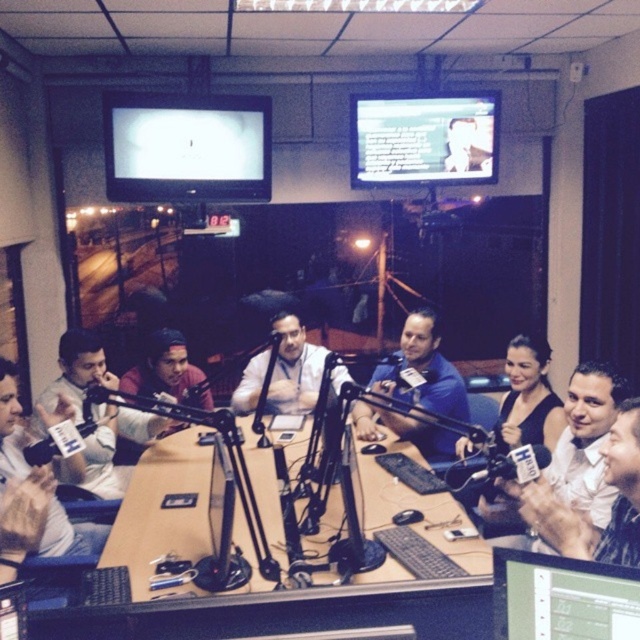
Question: Is matte black monitor at upper left thinner than matte black monitor at upper center?

Choices:
 (A) no
 (B) yes

Answer: (A)

Question: Which of these objects is positioned closest to the matte black monitor at upper left?

Choices:
 (A) light brown leather jacket at center
 (B) matte white shirt at left
 (C) brown wooden table at center

Answer: (A)

Question: Can you confirm if blue shirt at center is bigger than light brown leather jacket at center?

Choices:
 (A) yes
 (B) no

Answer: (A)

Question: Which of the following is the closest to the observer?

Choices:
 (A) (316, 540)
 (B) (221, 173)
 (C) (449, 365)

Answer: (A)

Question: Which of the following is the farthest from the observer?

Choices:
 (A) brown wooden table at center
 (B) matte black monitor at upper center

Answer: (B)

Question: Is brown wooden table at center further to the viewer compared to white glossy microphone at center?

Choices:
 (A) no
 (B) yes

Answer: (B)